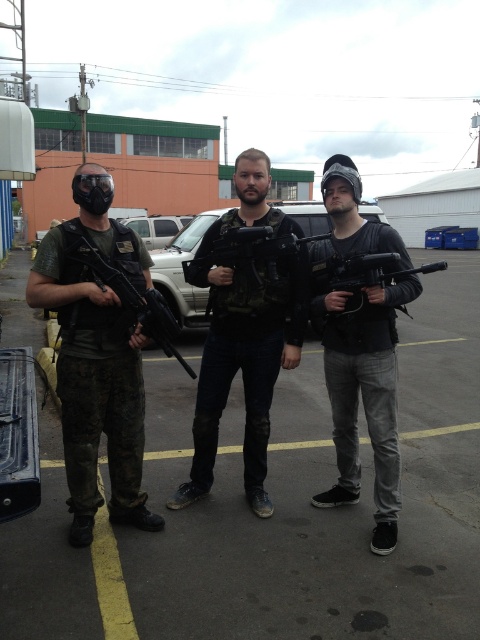
Question: Is matte black vest at center bigger than matte black rifle at left?

Choices:
 (A) yes
 (B) no

Answer: (A)

Question: Among these objects, which one is nearest to the camera?

Choices:
 (A) matte black helmet at center
 (B) matte black vest at center
 (C) matte black vest at left
 (D) matte black rifle at left

Answer: (D)

Question: Does matte black vest at center have a smaller size compared to matte black gun at center?

Choices:
 (A) no
 (B) yes

Answer: (A)

Question: Which of these objects is positioned farthest from the matte black vest at left?

Choices:
 (A) matte black helmet at center
 (B) concrete pavement at center

Answer: (B)

Question: Estimate the real-world distances between objects in this image. Which object is closer to the concrete pavement at center?

Choices:
 (A) matte black helmet at center
 (B) matte black gun at center
 (C) matte black rifle at left
 (D) matte black vest at center

Answer: (A)

Question: Does concrete pavement at center appear over matte black helmet at center?

Choices:
 (A) yes
 (B) no

Answer: (B)